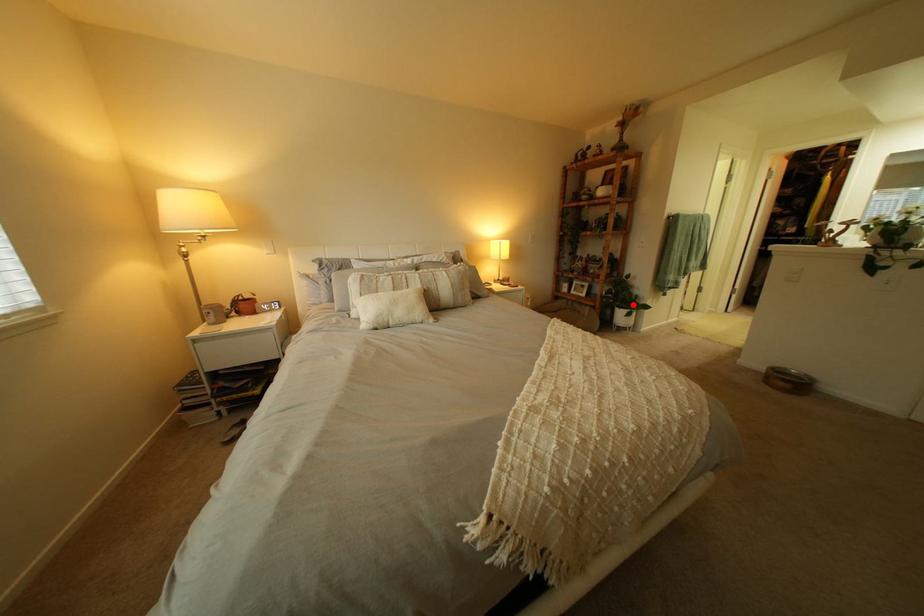
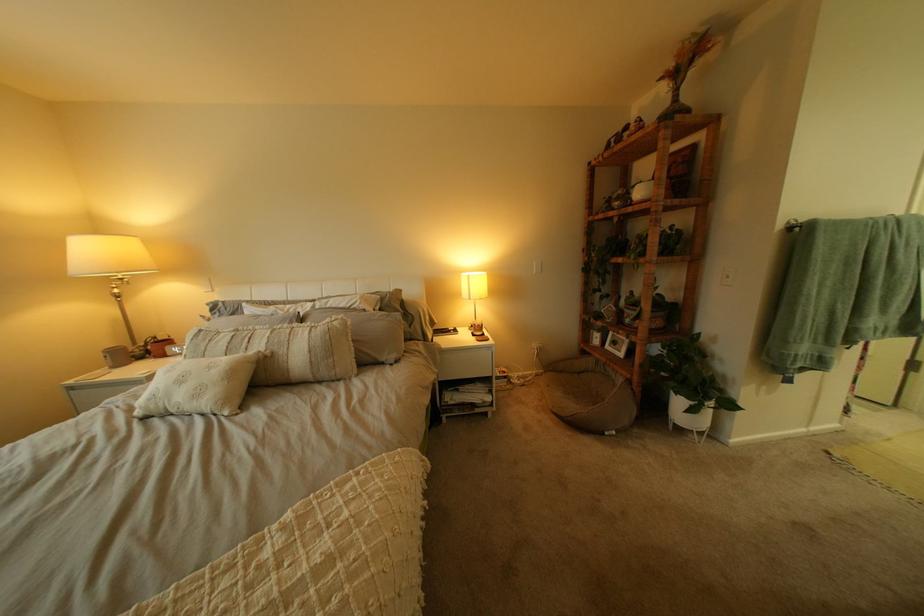
Locate, in the second image, the point that corresponds to the highlighted location in the first image.

(687, 385)